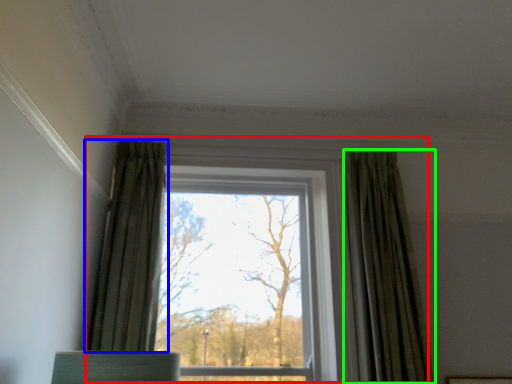
Question: Which is farther away from window (highlighted by a red box)? curtain (highlighted by a blue box) or curtain (highlighted by a green box)?

Choices:
 (A) curtain
 (B) curtain

Answer: (A)